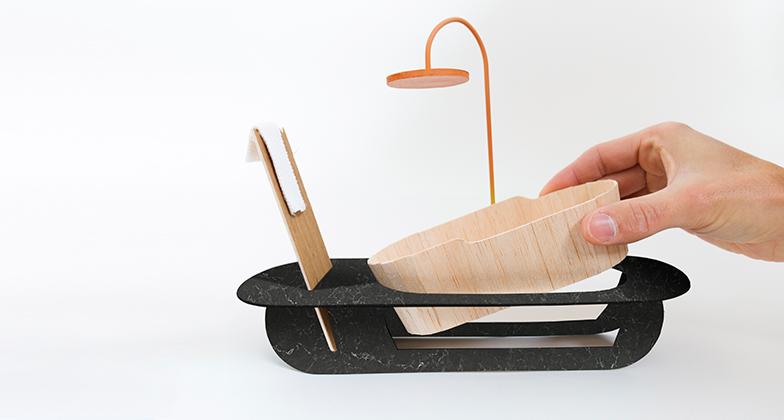
Identify the location of bath. The image size is (784, 420). (565, 241).